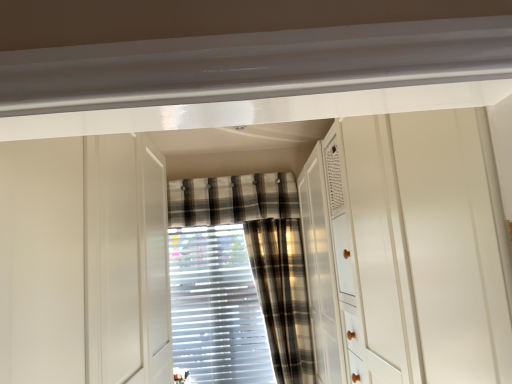
Question: From the image's perspective, relative to plaid fabric curtain at center, the third curtain from the back, is white glossy cabinet at center above or below?

Choices:
 (A) above
 (B) below

Answer: (A)

Question: From a real-world perspective, relative to plaid fabric curtain at center, the first curtain from the front, is white glossy cabinet at center vertically above or below?

Choices:
 (A) above
 (B) below

Answer: (A)

Question: Which of these objects is positioned farthest from the white glossy cabinet at center?

Choices:
 (A) white glossy dresser at center
 (B) plaid fabric curtain at center, acting as the 2th curtain starting from the front
 (C) plaid fabric curtain at center, the 3th curtain positioned from the front
 (D) plaid fabric curtain at center, the first curtain from the front

Answer: (B)

Question: Which is farther from the plaid fabric curtain at center, the third curtain from the back?

Choices:
 (A) white glossy dresser at center
 (B) white glossy cabinet at center
 (C) plaid fabric curtain at center, the first curtain viewed from the back
 (D) plaid fabric curtain at center, acting as the 2th curtain starting from the front

Answer: (B)